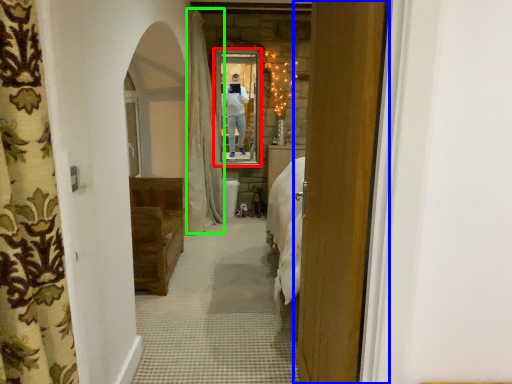
Question: Which is nearer to the mirror (highlighted by a red box)? door (highlighted by a blue box) or curtain (highlighted by a green box).

Choices:
 (A) door
 (B) curtain

Answer: (B)